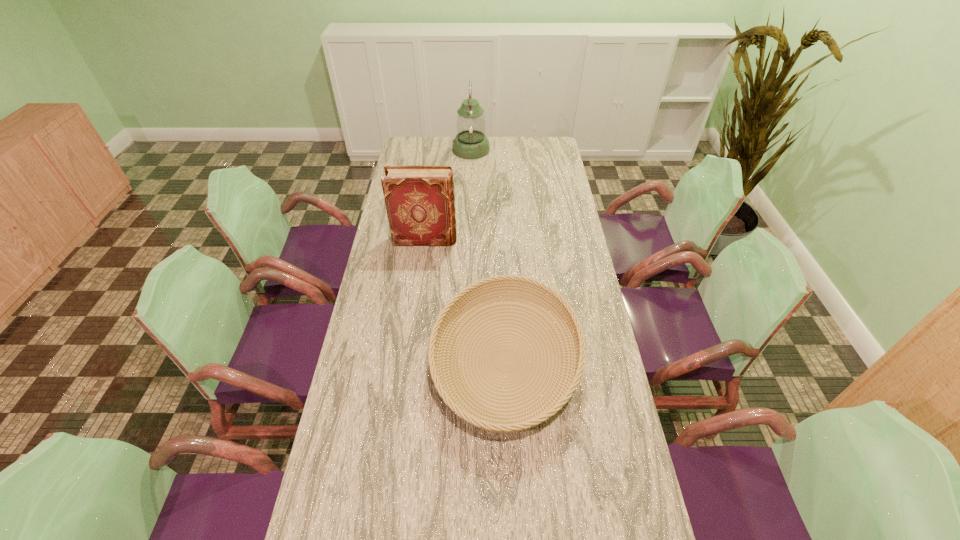
Locate an element on the screen. The image size is (960, 540). lantern is located at coordinates (470, 142).

The width and height of the screenshot is (960, 540). What are the coordinates of `the second farthest object` in the screenshot? It's located at (419, 199).

Where is `basket`? The image size is (960, 540). basket is located at coordinates (438, 370).

Where is `the shortest object`? This screenshot has width=960, height=540. the shortest object is located at coordinates (438, 370).

I want to click on free space located on the front of the lantern, so click(x=470, y=188).

Where is `vacant space located 0.170m on the spine side of the hardback book`? vacant space located 0.170m on the spine side of the hardback book is located at coordinates (499, 240).

You are a GUI agent. You are given a task and a screenshot of the screen. Output one action in this format:
    pyautogui.click(x=<x>, y=<y>)
    Task: Click on the free region located 0.360m on the back of the basket
    The height and width of the screenshot is (540, 960).
    Given the screenshot: What is the action you would take?
    pyautogui.click(x=499, y=230)

Where is `object that is at the far edge`? This screenshot has width=960, height=540. object that is at the far edge is located at coordinates (470, 142).

What are the coordinates of `object at the left edge` in the screenshot? It's located at (419, 199).

Identify the location of object located at the right edge. (438, 370).